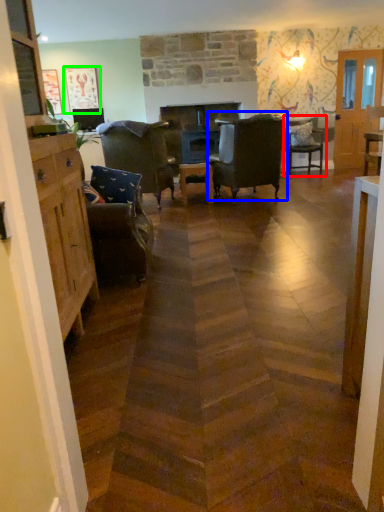
Question: Estimate the real-world distances between objects in this image. Which object is farther from chair (highlighted by a red box), chair (highlighted by a blue box) or picture frame (highlighted by a green box)?

Choices:
 (A) chair
 (B) picture frame

Answer: (B)